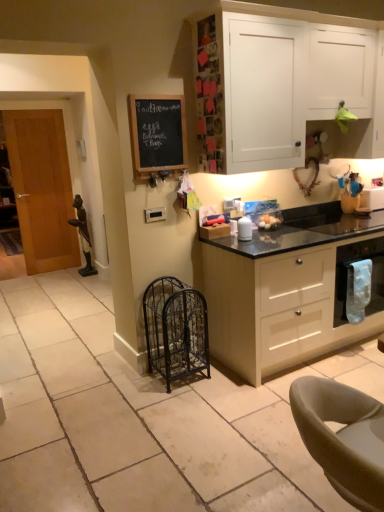
Question: Is leather-like gray chair at lower right positioned with its back to black wrought iron cage at lower center?

Choices:
 (A) no
 (B) yes

Answer: (A)

Question: Does leather-like gray chair at lower right have a greater width compared to black wrought iron cage at lower center?

Choices:
 (A) no
 (B) yes

Answer: (B)

Question: Is leather-like gray chair at lower right behind black wrought iron cage at lower center?

Choices:
 (A) yes
 (B) no

Answer: (B)

Question: Is leather-like gray chair at lower right thinner than black wrought iron cage at lower center?

Choices:
 (A) no
 (B) yes

Answer: (A)

Question: From a real-world perspective, is leather-like gray chair at lower right positioned over black wrought iron cage at lower center based on gravity?

Choices:
 (A) yes
 (B) no

Answer: (A)

Question: Is leather-like gray chair at lower right taller than black wrought iron cage at lower center?

Choices:
 (A) no
 (B) yes

Answer: (B)

Question: Is beige matte cabinet at center, the second cabinetry in the top-to-bottom sequence, turned away from black wrought iron cage at lower center?

Choices:
 (A) no
 (B) yes

Answer: (A)

Question: Is the depth of beige matte cabinet at center, the 1th cabinetry ordered from the bottom, less than that of black wrought iron cage at lower center?

Choices:
 (A) yes
 (B) no

Answer: (A)

Question: From a real-world perspective, is beige matte cabinet at center, the 1th cabinetry ordered from the bottom, beneath black wrought iron cage at lower center?

Choices:
 (A) no
 (B) yes

Answer: (A)

Question: Is beige matte cabinet at center, the 1th cabinetry ordered from the bottom, to the right of black wrought iron cage at lower center from the viewer's perspective?

Choices:
 (A) no
 (B) yes

Answer: (B)

Question: Is the position of beige matte cabinet at center, the 1th cabinetry ordered from the bottom, more distant than that of black wrought iron cage at lower center?

Choices:
 (A) yes
 (B) no

Answer: (B)

Question: From the image's perspective, is beige matte cabinet at center, the 1th cabinetry ordered from the bottom, under black wrought iron cage at lower center?

Choices:
 (A) yes
 (B) no

Answer: (B)

Question: Does blue fabric towel at right come behind leather-like gray chair at lower right?

Choices:
 (A) yes
 (B) no

Answer: (A)